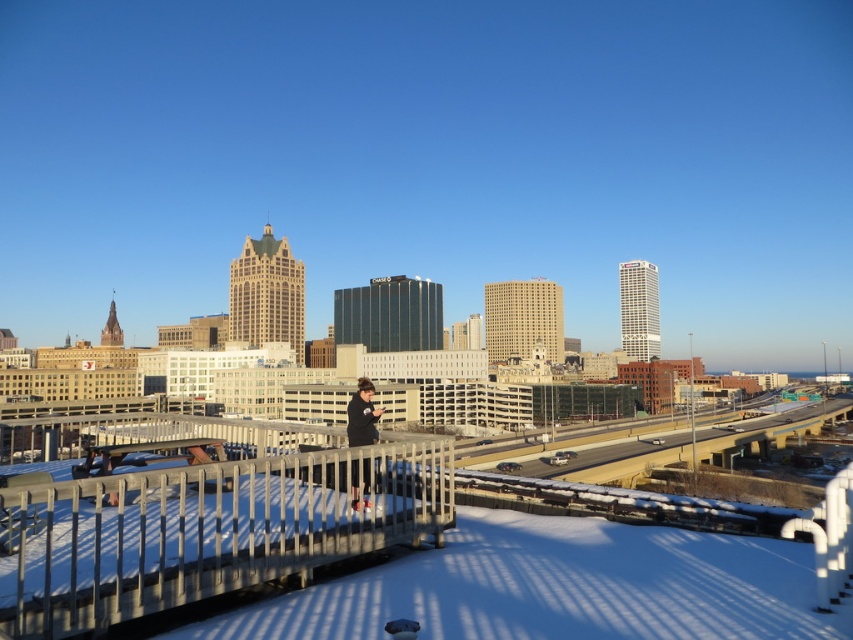
Question: Among these points, which one is nearest to the camera?

Choices:
 (A) (363, 470)
 (B) (68, 509)

Answer: (B)

Question: Can you confirm if metallic gray railing at lower center is positioned below black fabric at center?

Choices:
 (A) yes
 (B) no

Answer: (A)

Question: Is metallic gray railing at lower center positioned behind black fabric at center?

Choices:
 (A) yes
 (B) no

Answer: (B)

Question: Which point is farther from the camera taking this photo?

Choices:
 (A) (366, 404)
 (B) (154, 513)

Answer: (A)

Question: Can you confirm if metallic gray railing at lower center is smaller than black fabric at center?

Choices:
 (A) no
 (B) yes

Answer: (A)

Question: Which of the following is the farthest from the observer?

Choices:
 (A) metallic gray railing at lower center
 (B) black fabric at center

Answer: (B)